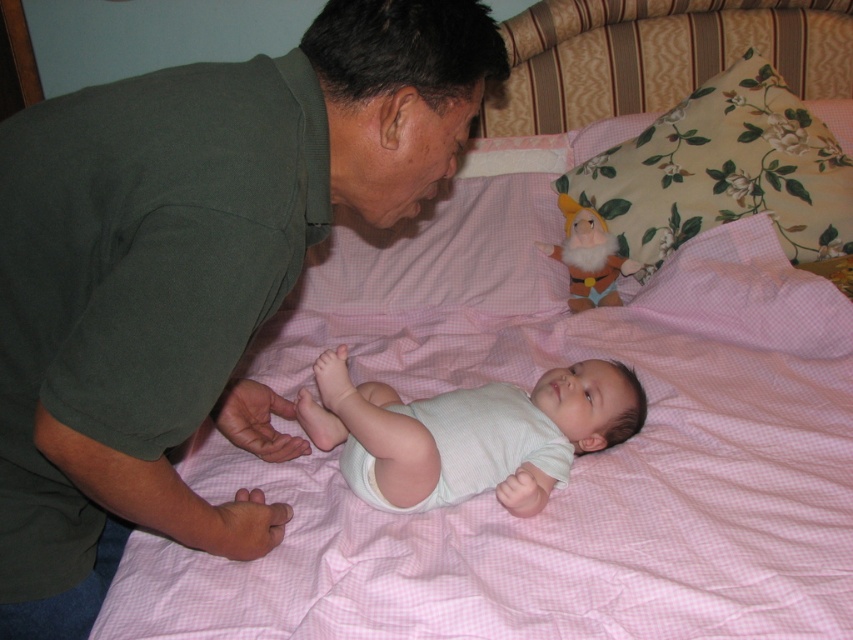
You are a photographer trying to capture a closeup shot of the green matte shirt at upper left and the white ribbed onesie at center. Your camera can only focus on objects within a 30 cm distance. Can you take a photo of both objects without moving them?

The green matte shirt at upper left and white ribbed onesie at center are 31.82 centimeters apart, which exceeds the camera focus range of 30 cm. Therefore, you cannot take a photo of both objects without moving them.

You are an interior designer analyzing the placement of objects in the room. The green matte shirt at upper left is part of the scene. Can you determine its exact coordinates in the image?

The green matte shirt at upper left is located at point (190, 275).

You are a photographer taking a picture of the scene. You want to focus on the point at coordinates point (x=251, y=388) and point (x=793, y=180). Which point should you adjust your focus to first to ensure both are in the frame?

Point (x=251, y=388) is in front of point (x=793, y=180). Therefore, you should focus on point (x=251, y=388) first to ensure both points are in the frame.